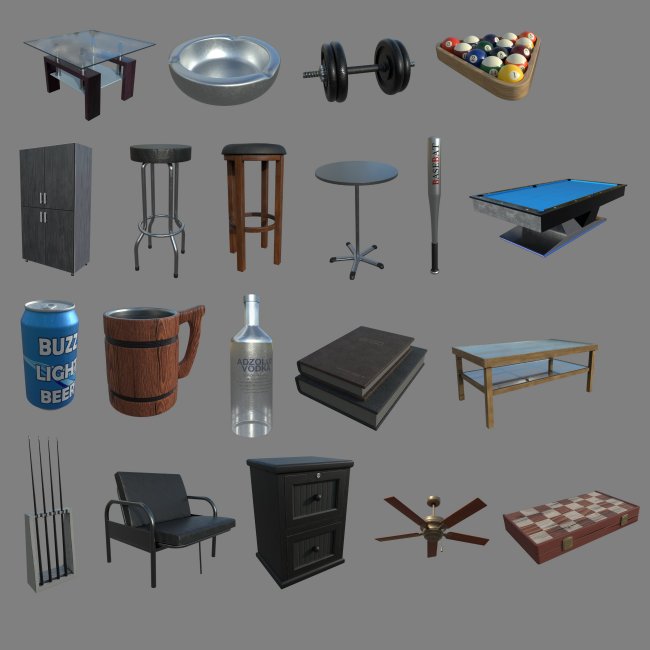
Locate an element on the screen. table legs is located at coordinates (348, 270), (367, 263), (368, 246), (350, 246), (344, 257).